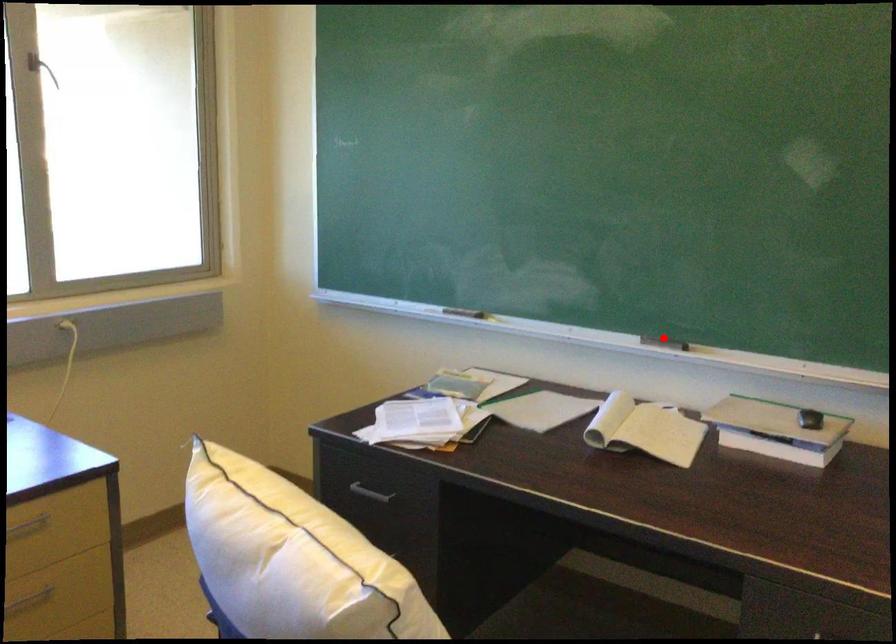
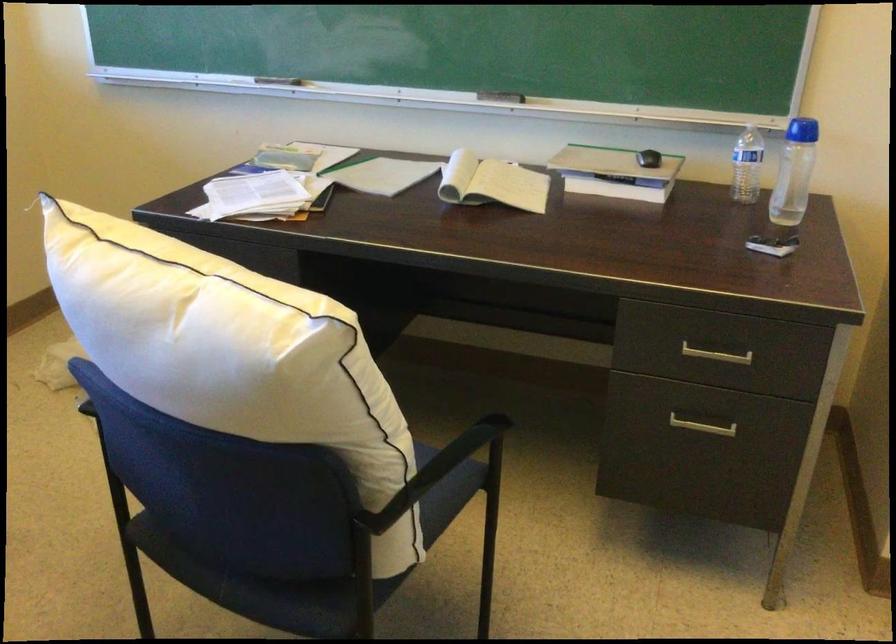
The point at the highlighted location is marked in the first image. Where is the corresponding point in the second image?

(501, 96)